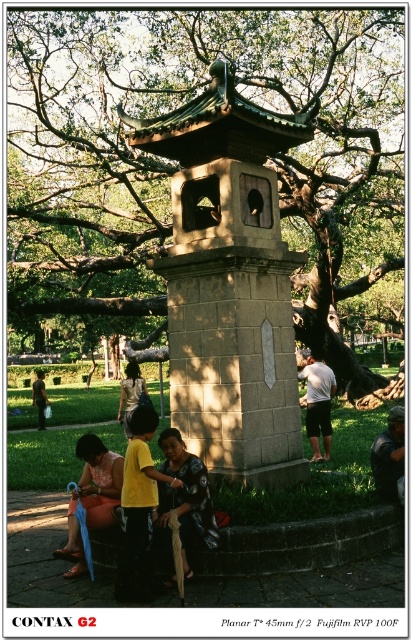
Question: Does matte orange dress at lower left have a lesser width compared to white cotton shirt at center?

Choices:
 (A) yes
 (B) no

Answer: (A)

Question: Does yellow matte shirt at center have a greater width compared to matte orange dress at lower left?

Choices:
 (A) no
 (B) yes

Answer: (A)

Question: Estimate the real-world distances between objects in this image. Which object is farther from the white cotton shirt at center?

Choices:
 (A) dark floral dress at center
 (B) yellow matte shirt at center

Answer: (B)

Question: Does yellow matte shirt at center have a smaller size compared to matte orange dress at lower left?

Choices:
 (A) yes
 (B) no

Answer: (A)

Question: Which is nearer to the yellow t-shirt at lower left?

Choices:
 (A) dark floral dress at center
 (B) dark blue fabric at lower right
 (C) gray stone gazebo at center
 (D) yellow matte shirt at center

Answer: (D)

Question: Estimate the real-world distances between objects in this image. Which object is closer to the dark floral dress at center?

Choices:
 (A) matte orange dress at lower left
 (B) yellow matte shirt at center

Answer: (B)